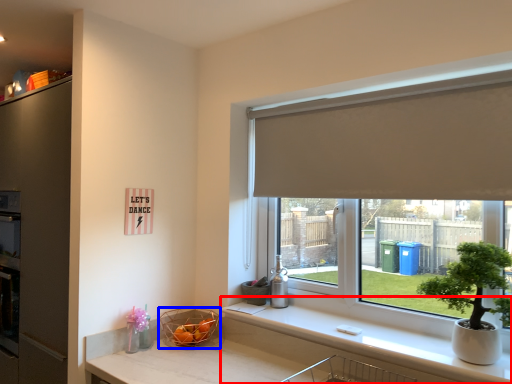
Question: Which object is closer to the camera taking this photo, counter top (highlighted by a red box) or basket (highlighted by a blue box)?

Choices:
 (A) counter top
 (B) basket

Answer: (A)